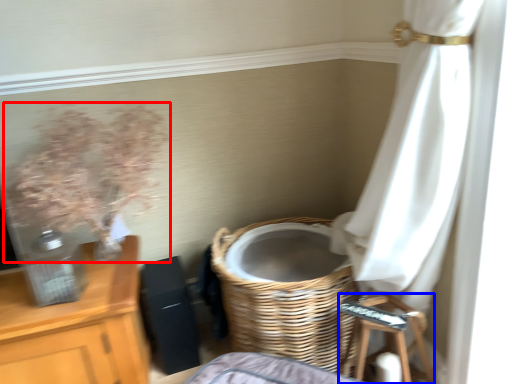
Question: Which object appears closest to the camera in this image, floral arrangement (highlighted by a red box) or step stool (highlighted by a blue box)?

Choices:
 (A) floral arrangement
 (B) step stool

Answer: (A)